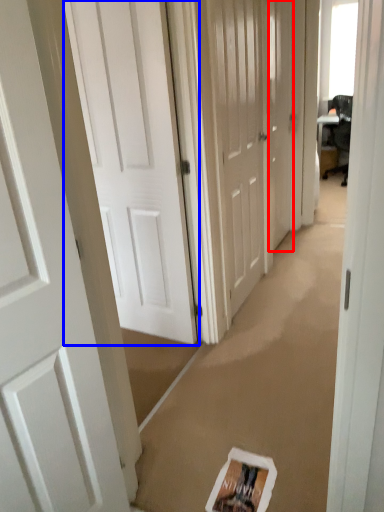
Question: Among these objects, which one is farthest to the camera, door (highlighted by a red box) or door (highlighted by a blue box)?

Choices:
 (A) door
 (B) door

Answer: (A)